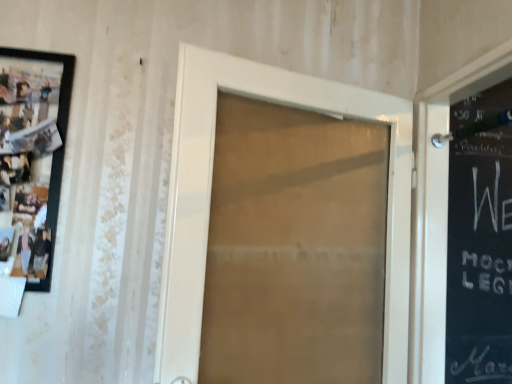
Question: Should I look upward or downward to see matte black picture frame at left?

Choices:
 (A) up
 (B) down

Answer: (A)

Question: Is matte black picture frame at left to the right of white glossy door at center from the viewer's perspective?

Choices:
 (A) yes
 (B) no

Answer: (B)

Question: From a real-world perspective, is matte black picture frame at left under white glossy door at center?

Choices:
 (A) yes
 (B) no

Answer: (B)

Question: Is matte black picture frame at left oriented away from white glossy door at center?

Choices:
 (A) no
 (B) yes

Answer: (A)

Question: Is matte black picture frame at left positioned far away from white glossy door at center?

Choices:
 (A) no
 (B) yes

Answer: (A)

Question: Considering the relative sizes of matte black picture frame at left and white glossy door at center in the image provided, is matte black picture frame at left smaller than white glossy door at center?

Choices:
 (A) yes
 (B) no

Answer: (A)

Question: Is matte black picture frame at left closer to camera compared to white glossy door at center?

Choices:
 (A) no
 (B) yes

Answer: (A)

Question: Considering the relative sizes of white glossy door at center and matte black picture frame at left in the image provided, is white glossy door at center wider than matte black picture frame at left?

Choices:
 (A) no
 (B) yes

Answer: (B)

Question: Is the depth of white glossy door at center less than that of matte black picture frame at left?

Choices:
 (A) yes
 (B) no

Answer: (A)

Question: Is matte black picture frame at left inside white glossy door at center?

Choices:
 (A) no
 (B) yes

Answer: (A)

Question: Is white glossy door at center positioned with its back to matte black picture frame at left?

Choices:
 (A) no
 (B) yes

Answer: (A)

Question: Is white glossy door at center at the right side of matte black picture frame at left?

Choices:
 (A) yes
 (B) no

Answer: (A)

Question: Can you confirm if white glossy door at center is smaller than matte black picture frame at left?

Choices:
 (A) yes
 (B) no

Answer: (B)

Question: Based on their sizes in the image, would you say matte black picture frame at left is bigger or smaller than white glossy door at center?

Choices:
 (A) big
 (B) small

Answer: (B)